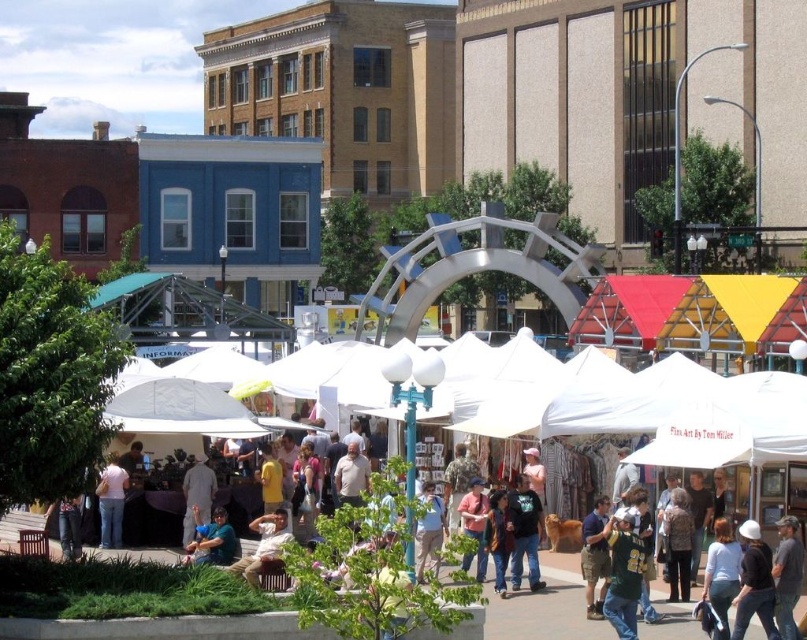
Question: Can you confirm if dark blue t-shirt at center is smaller than light blue denim jeans at center?

Choices:
 (A) yes
 (B) no

Answer: (A)

Question: Which of the following is the farthest from the observer?

Choices:
 (A) (596, 570)
 (B) (638, 552)

Answer: (A)

Question: Which object appears closest to the camera in this image?

Choices:
 (A) pink cotton shirt at center
 (B) light blue denim jeans at center
 (C) white matte shirt at center

Answer: (B)

Question: Does denim pants at center appear on the left side of light blue denim jeans at center?

Choices:
 (A) no
 (B) yes

Answer: (B)

Question: Is brown leather jacket at center to the left of light brown wooden bench at center from the viewer's perspective?

Choices:
 (A) yes
 (B) no

Answer: (B)

Question: Which object appears farthest from the camera in this image?

Choices:
 (A) green jersey at center
 (B) white matte shirt at center

Answer: (A)